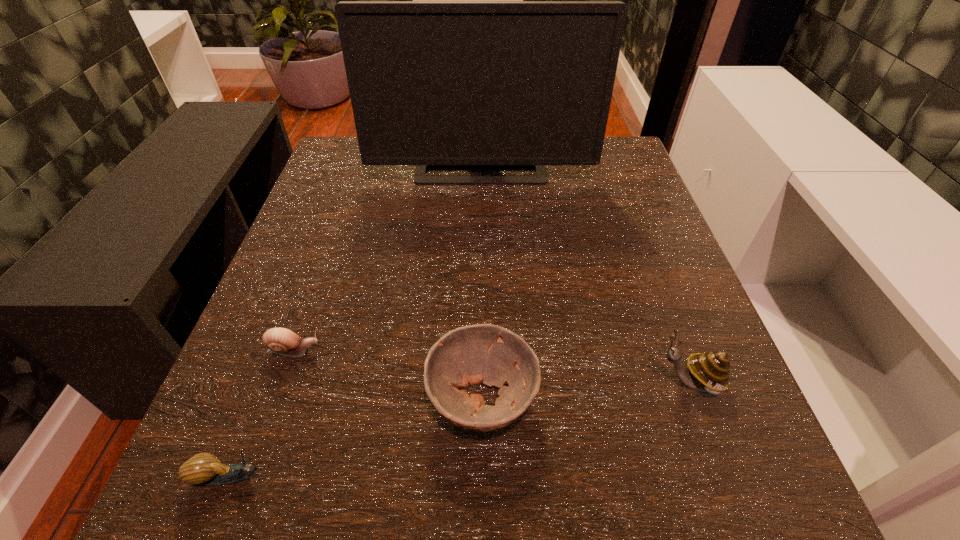
At what (x,y) coordinates should I click in order to perform the action: click on the tallest object. Please return your answer as a coordinate pair (x, y). This screenshot has width=960, height=540. Looking at the image, I should click on (438, 84).

You are a GUI agent. You are given a task and a screenshot of the screen. Output one action in this format:
    pyautogui.click(x=<x>, y=<y>)
    Task: Click on the computer monitor
    
    Given the screenshot: What is the action you would take?
    pyautogui.click(x=438, y=84)

Locate an element on the screen. the tallest escargot is located at coordinates point(710,371).

Where is `the second nearest escargot`? the second nearest escargot is located at coordinates (710, 371).

This screenshot has width=960, height=540. Identify the location of the third tallest object. (483, 353).

Locate an element on the screen. The height and width of the screenshot is (540, 960). the nearest object is located at coordinates (204, 468).

At what (x,y) coordinates should I click in order to perform the action: click on the farthest escargot. Please return your answer as a coordinate pair (x, y). This screenshot has width=960, height=540. Looking at the image, I should click on (282, 341).

The height and width of the screenshot is (540, 960). Identify the location of vacant space positioned on the screen side of the computer monitor. (481, 331).

This screenshot has width=960, height=540. What are the coordinates of `vacant area located on the face of the fourth shortest object` in the screenshot? It's located at (493, 382).

Find the location of a particular element. The height and width of the screenshot is (540, 960). free region located 0.320m on the face of the fourth shortest object is located at coordinates (423, 382).